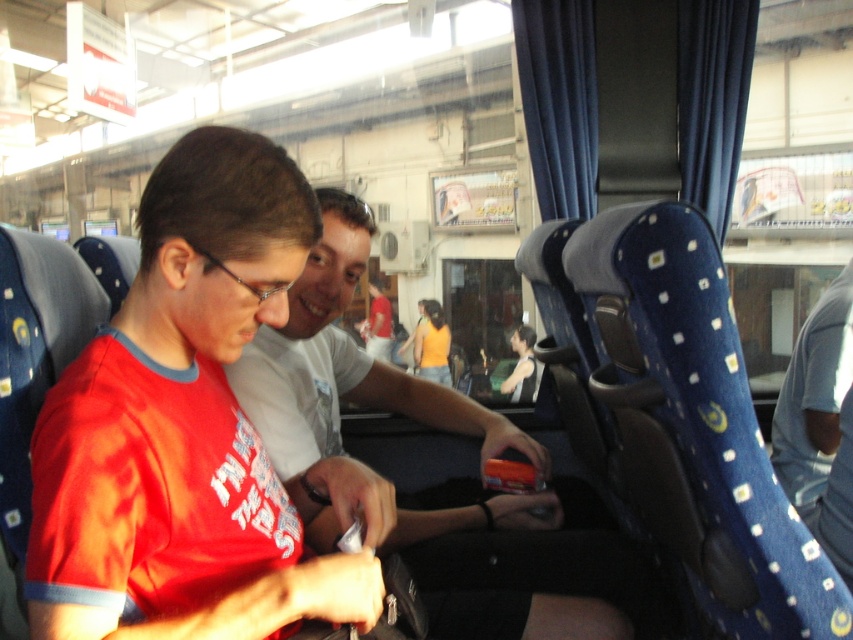
Question: Considering the real-world distances, which object is farthest from the matte white shirt at center?

Choices:
 (A) blue denim jeans at lower right
 (B) matte black hair at center
 (C) matte red shirt at center

Answer: (C)

Question: Which of the following is the farthest from the observer?

Choices:
 (A) (527, 340)
 (B) (376, 371)
 (C) (219, 616)
 (D) (851, 324)

Answer: (A)

Question: Which point is closer to the camera?

Choices:
 (A) (532, 388)
 (B) (824, 336)
 (C) (335, 429)

Answer: (C)

Question: Where is matte black hair at center located in relation to matte white shirt at center in the image?

Choices:
 (A) above
 (B) below

Answer: (B)

Question: Considering the relative positions of blue denim jeans at lower right and matte white shirt at center in the image provided, where is blue denim jeans at lower right located with respect to matte white shirt at center?

Choices:
 (A) below
 (B) above

Answer: (A)

Question: Can you confirm if matte red shirt at center is wider than orange fabric top at center?

Choices:
 (A) no
 (B) yes

Answer: (B)